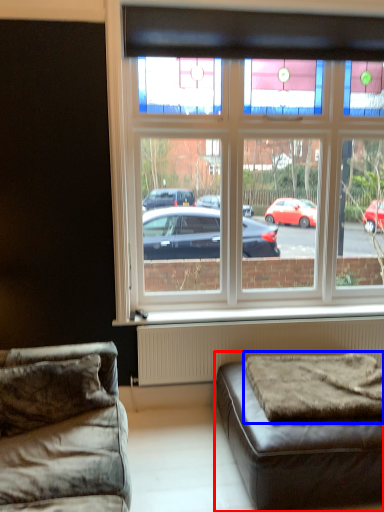
Question: Which of the following is the farthest to the observer, studio couch (highlighted by a red box) or mattress (highlighted by a blue box)?

Choices:
 (A) studio couch
 (B) mattress

Answer: (B)